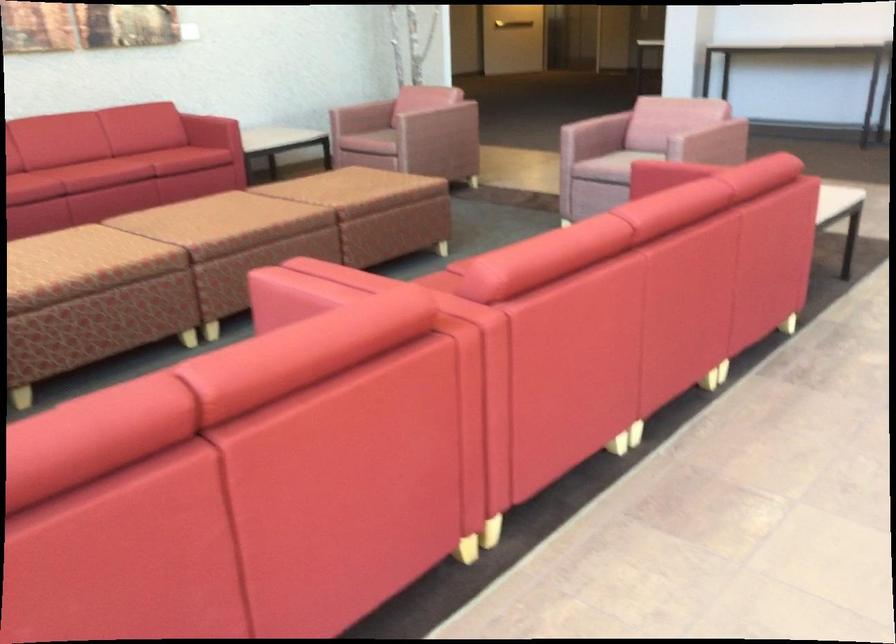
Find the location of a particular element. Image resolution: width=896 pixels, height=644 pixels. horizontal door handle is located at coordinates (512, 24).